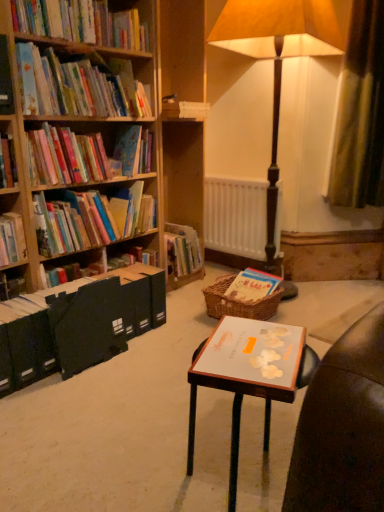
Identify the location of vacant space to the right of brown woven picnic basket at center. (304, 308).